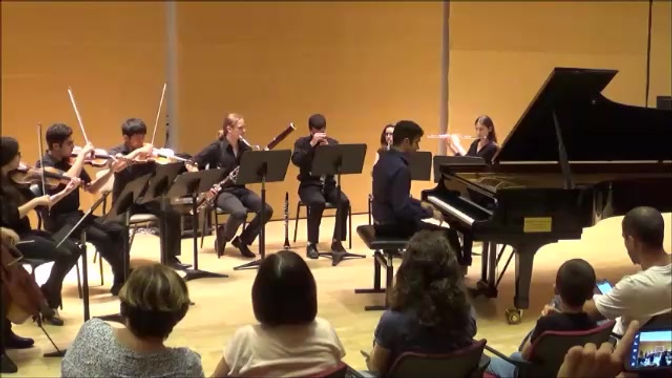
The height and width of the screenshot is (378, 672). In order to click on grand piano in this screenshot , I will do `click(589, 148)`.